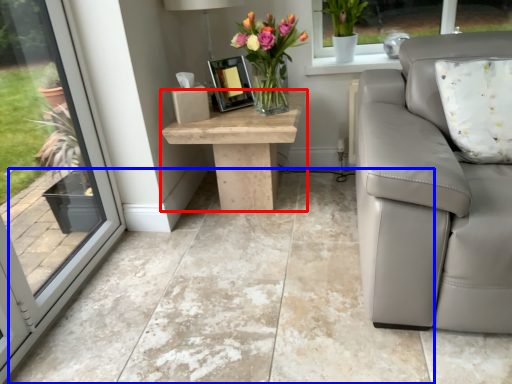
Question: Among these objects, which one is nearest to the camera, table (highlighted by a red box) or concrete (highlighted by a blue box)?

Choices:
 (A) table
 (B) concrete

Answer: (B)